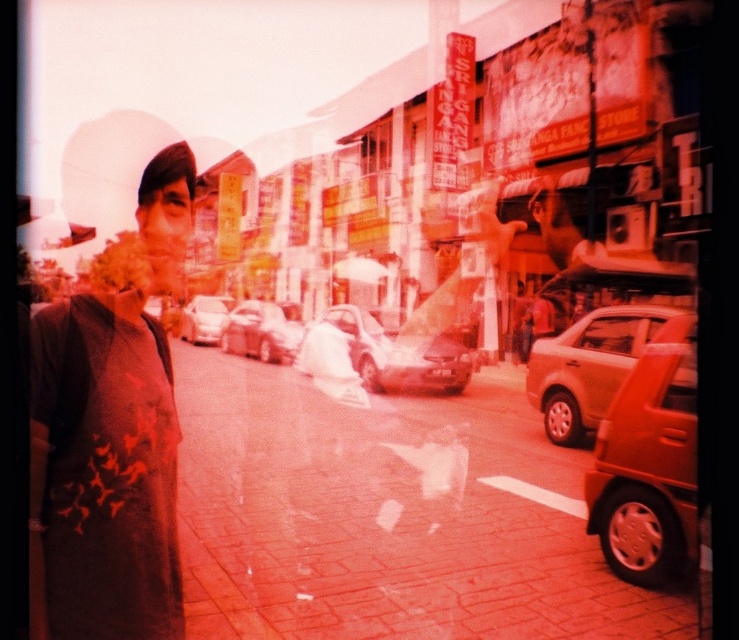
Does matte gold car at right appear on the left side of shiny silver car at center?

In fact, matte gold car at right is to the right of shiny silver car at center.

Which is behind, point (542, 369) or point (268, 326)?

Positioned behind is point (268, 326).

What do you see at coordinates (588, 365) in the screenshot? I see `matte gold car at right` at bounding box center [588, 365].

This screenshot has width=739, height=640. Identify the location of matte gold car at right. (x=588, y=365).

Which is more to the left, brick pavement at center or shiny silver sedan at center?

shiny silver sedan at center is more to the left.

Consider the image. Can you confirm if brick pavement at center is shorter than shiny silver sedan at center?

Indeed, brick pavement at center has a lesser height compared to shiny silver sedan at center.

I want to click on brick pavement at center, so click(386, 516).

The width and height of the screenshot is (739, 640). Identify the location of brick pavement at center. (386, 516).

Who is higher up, brick pavement at center or matte silver car at center?

matte silver car at center is higher up.

Is point (187, 403) positioned after point (437, 349)?

No, (187, 403) is in front of (437, 349).

Does point (228, 484) come farther from viewer compared to point (384, 371)?

No, it is not.

Where is `brick pavement at center`? This screenshot has width=739, height=640. brick pavement at center is located at coordinates 386,516.